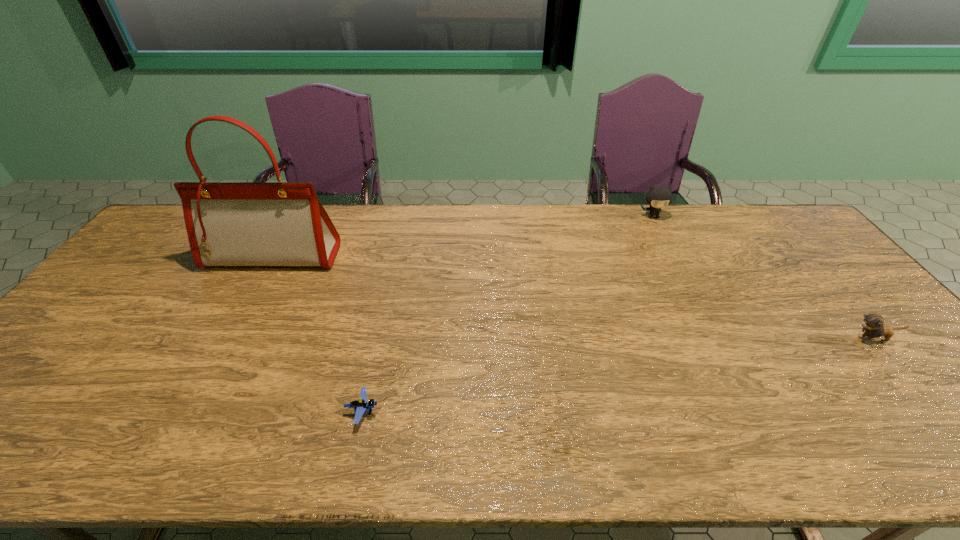
The height and width of the screenshot is (540, 960). I want to click on vacant space in between the leftmost object and the shortest object, so click(x=318, y=334).

The image size is (960, 540). Find the location of `vacant region between the leftmost object and the shorter kitten`. vacant region between the leftmost object and the shorter kitten is located at coordinates (573, 298).

Identify which object is the second closest to the second object from left to right. Please provide its 2D coordinates. Your answer should be formatted as a tuple, i.e. [(x, y)], where the tuple contains the x and y coordinates of a point satisfying the conditions above.

[(657, 197)]

Identify which object is located as the third nearest to the second nearest object. Please provide its 2D coordinates. Your answer should be formatted as a tuple, i.e. [(x, y)], where the tuple contains the x and y coordinates of a point satisfying the conditions above.

[(241, 224)]